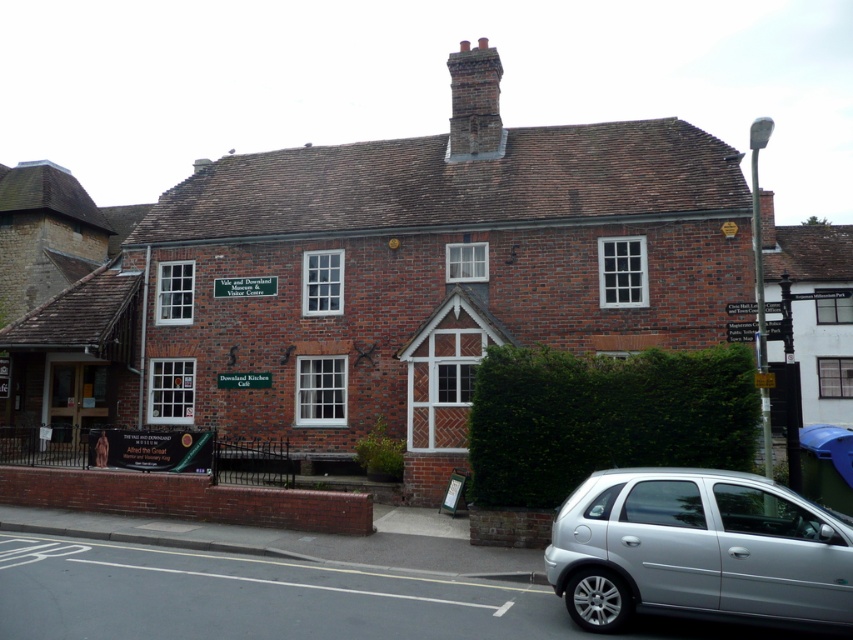
You are standing in front of the traditional brick building and want to take a photo. You notice two points marked on the building. The first point is at coordinates point (732, 413) and the second is at point (480, 90). Which point is closer to your camera when taking the photo?

Point (732, 413) is closer to the camera than point (480, 90).

You are a visitor arriving at the Vale and Downland Museum. You see a silver metallic hatchback at lower right and a brick chimney at upper center. Which object is nearer to you as you approach the building?

The silver metallic hatchback at lower right is closer to the viewer than the brick chimney at upper center.

You are standing at the front entrance of the Vale and Downland Museum and Visitor Centre. You need to park your car, which is a silver metallic hatchback at lower right, as close as possible to the brick chimney at upper center without blocking the entrance. What is the closest distance you can park your car from the chimney?

The silver metallic hatchback at lower right can be parked as close as 50.65 feet from the brick chimney at upper center, as that is the distance between them.